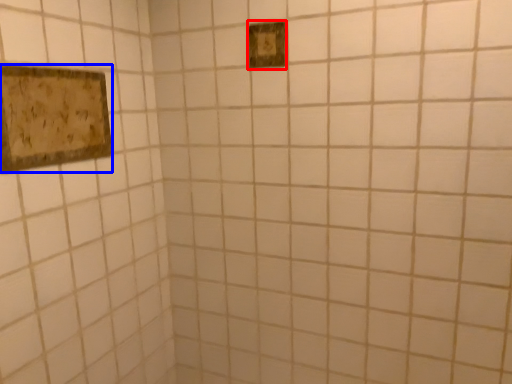
Question: Among these objects, which one is farthest to the camera, light switch (highlighted by a red box) or picture frame (highlighted by a blue box)?

Choices:
 (A) light switch
 (B) picture frame

Answer: (A)